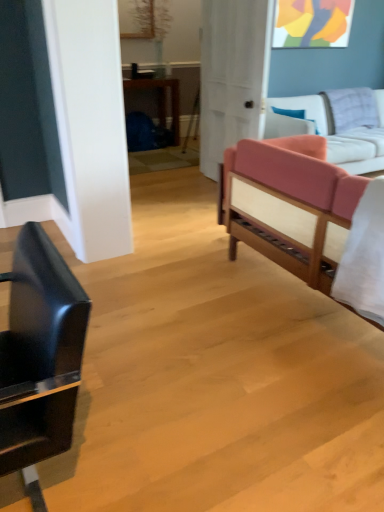
Question: From a real-world perspective, is shiny black chair at left below pink fabric studio couch at right, positioned as the first studio couch in back-to-front order?

Choices:
 (A) yes
 (B) no

Answer: (B)

Question: Is shiny black chair at left beside pink fabric studio couch at right, placed as the 2th studio couch when sorted from front to back?

Choices:
 (A) no
 (B) yes

Answer: (A)

Question: Considering the relative sizes of shiny black chair at left and pink fabric studio couch at right, placed as the 2th studio couch when sorted from front to back, in the image provided, is shiny black chair at left thinner than pink fabric studio couch at right, placed as the 2th studio couch when sorted from front to back,?

Choices:
 (A) no
 (B) yes

Answer: (B)

Question: Is shiny black chair at left not close to pink fabric studio couch at right, placed as the 2th studio couch when sorted from front to back?

Choices:
 (A) yes
 (B) no

Answer: (A)

Question: Is shiny black chair at left behind pink fabric studio couch at right, placed as the 2th studio couch when sorted from front to back?

Choices:
 (A) no
 (B) yes

Answer: (A)

Question: From the image's perspective, is shiny black chair at left located above or below pink fabric studio couch at right, positioned as the first studio couch in back-to-front order?

Choices:
 (A) above
 (B) below

Answer: (B)

Question: Considering the positions of point (11, 302) and point (311, 98), is point (11, 302) closer or farther from the camera than point (311, 98)?

Choices:
 (A) farther
 (B) closer

Answer: (B)

Question: Looking at their shapes, would you say shiny black chair at left is wider or thinner than pink fabric studio couch at right, positioned as the first studio couch in back-to-front order?

Choices:
 (A) wide
 (B) thin

Answer: (B)

Question: From a real-world perspective, is shiny black chair at left above or below pink fabric studio couch at right, positioned as the first studio couch in back-to-front order?

Choices:
 (A) above
 (B) below

Answer: (A)

Question: Based on their sizes in the image, would you say pink fabric studio couch at right, placed as the 2th studio couch when sorted from front to back, is bigger or smaller than pink fabric couch at right, the 1th studio couch when ordered from front to back?

Choices:
 (A) small
 (B) big

Answer: (B)

Question: Considering the positions of pink fabric studio couch at right, placed as the 2th studio couch when sorted from front to back, and pink fabric couch at right, the 1th studio couch when ordered from front to back, in the image, is pink fabric studio couch at right, placed as the 2th studio couch when sorted from front to back, wider or thinner than pink fabric couch at right, the 1th studio couch when ordered from front to back,?

Choices:
 (A) thin
 (B) wide

Answer: (A)

Question: Based on their positions, is pink fabric studio couch at right, positioned as the first studio couch in back-to-front order, located to the left or right of pink fabric couch at right, the second studio couch from the back?

Choices:
 (A) right
 (B) left

Answer: (A)

Question: From the image's perspective, relative to pink fabric couch at right, the 1th studio couch when ordered from front to back, is pink fabric studio couch at right, positioned as the first studio couch in back-to-front order, above or below?

Choices:
 (A) below
 (B) above

Answer: (B)

Question: Visually, is white matte door at center positioned to the left or to the right of pink fabric studio couch at right, positioned as the first studio couch in back-to-front order?

Choices:
 (A) left
 (B) right

Answer: (A)

Question: In terms of width, does white matte door at center look wider or thinner when compared to pink fabric studio couch at right, placed as the 2th studio couch when sorted from front to back?

Choices:
 (A) thin
 (B) wide

Answer: (A)